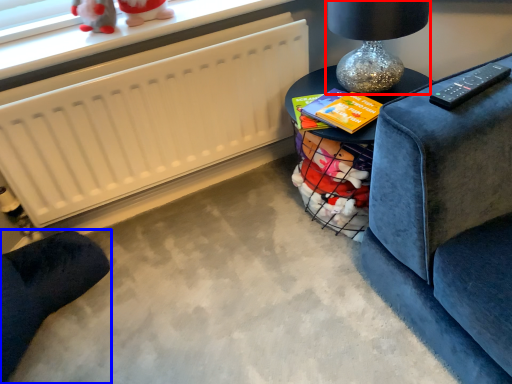
Question: Which object appears closest to the camera in this image, table lamp (highlighted by a red box) or furniture (highlighted by a blue box)?

Choices:
 (A) table lamp
 (B) furniture

Answer: (B)